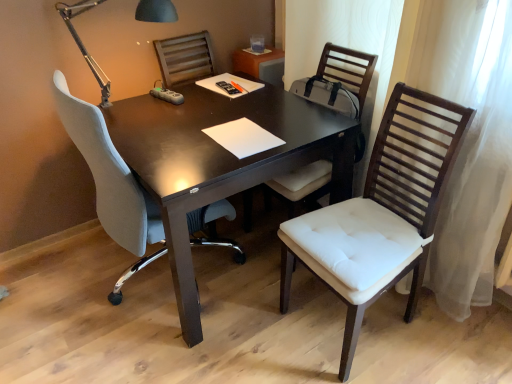
Locate an element on the screen. empty space that is in between dark wood table at center and white fabric chair at left, which is the 1th chair from left to right is located at coordinates (156, 342).